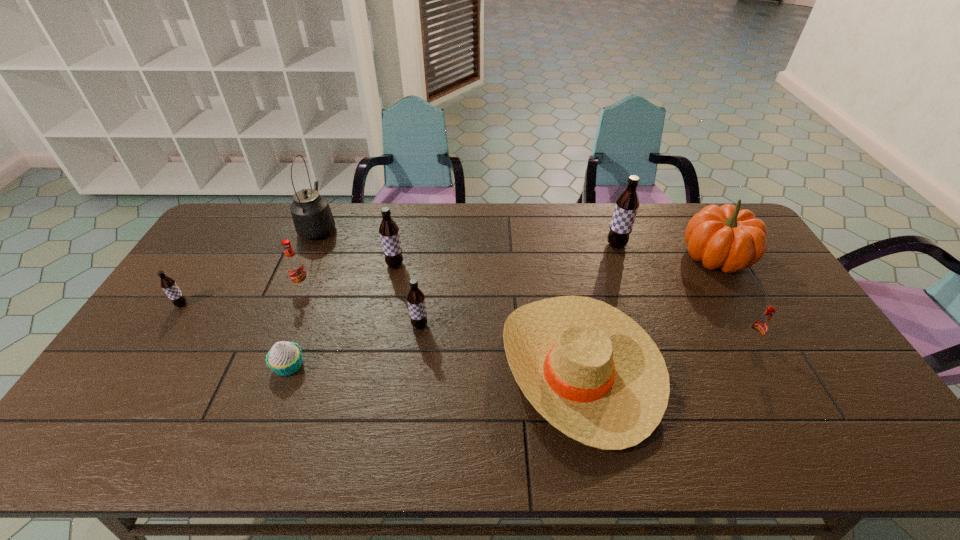
This screenshot has width=960, height=540. I want to click on the third nearest root beer, so click(x=169, y=285).

Identify the location of the leftmost root beer. The width and height of the screenshot is (960, 540). (169, 285).

Image resolution: width=960 pixels, height=540 pixels. Identify the location of the nearest root beer. (760, 326).

Find the location of a particular element. the nearer red root beer is located at coordinates (760, 326).

Where is `sunhat`? Image resolution: width=960 pixels, height=540 pixels. sunhat is located at coordinates (591, 371).

Identify the location of the shortest object. (285, 358).

In order to click on white cupcake in this screenshot , I will do `click(285, 358)`.

Identify the location of free space located 0.310m on the front of the farthest root beer. The width and height of the screenshot is (960, 540). (642, 321).

The image size is (960, 540). I want to click on free region located 0.310m on the back of the sixth object from right to left, so click(x=407, y=206).

This screenshot has width=960, height=540. Find the location of `free location located 0.150m on the left of the pumpkin`. free location located 0.150m on the left of the pumpkin is located at coordinates (636, 257).